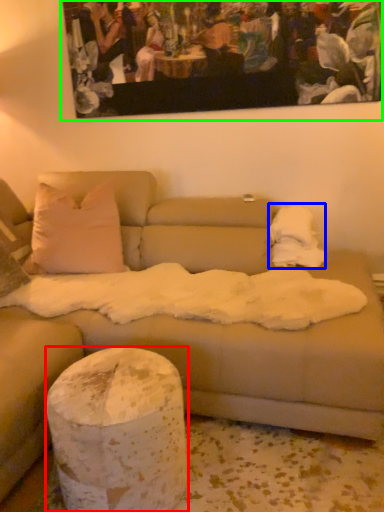
Question: Based on their relative distances, which object is nearer to pillar (highlighted by a red box)? Choose from blanket (highlighted by a blue box) and picture frame (highlighted by a green box).

Choices:
 (A) blanket
 (B) picture frame

Answer: (A)